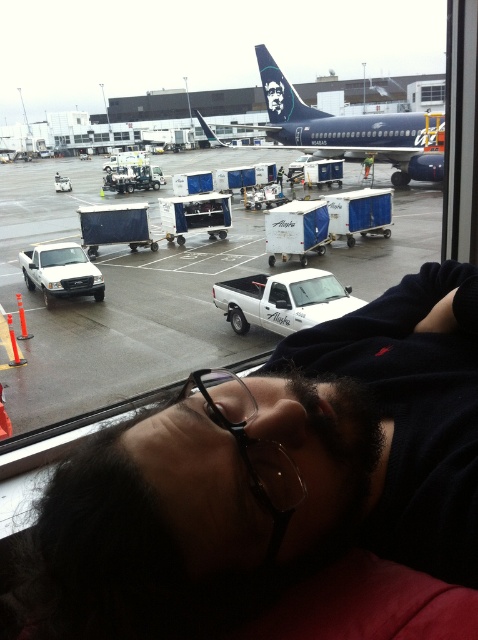
In the scene shown: You are an airport security officer looking at a surveillance camera feed. You notice a person lying down in the foreground. Where exactly is the dark hair at lower center located in the image?

The dark hair at lower center is located at point coordinates of (271,476).

You are a passenger in the airport terminal who wants to drink water. You see the white plastic containers at center and the transparent plastic glasses at center. Which one can you use to hold more water?

The white plastic containers at center is much taller than the transparent plastic glasses at center, so it can hold more water.

You are a passenger who just arrived at the airport and is looking out the window. You see dark hair at lower center and white plastic containers at center. Which object is closer to the window?

The dark hair at lower center is closer to the window because it is positioned under the white plastic containers at center, meaning it is in front of them from the viewer perspective.